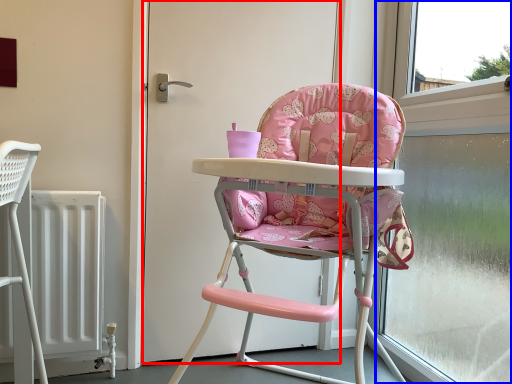
Question: Which object appears farthest to the camera in this image, door (highlighted by a red box) or window frame (highlighted by a blue box)?

Choices:
 (A) door
 (B) window frame

Answer: (A)